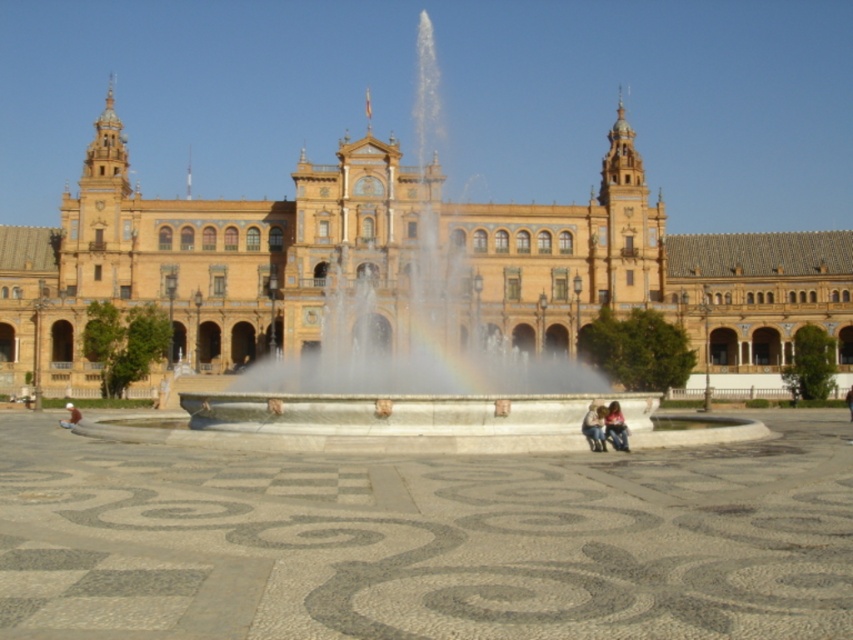
Question: Which object is positioned farthest from the light brown leather jacket at lower right?

Choices:
 (A) denim jeans at center
 (B) golden stone palace at center

Answer: (B)

Question: Which point is closer to the camera taking this photo?

Choices:
 (A) (67, 420)
 (B) (589, 413)
 (C) (622, 442)
 (D) (349, 193)

Answer: (C)

Question: Does denim jeans at center lie behind light brown leather jacket at lower right?

Choices:
 (A) yes
 (B) no

Answer: (A)

Question: Can you confirm if denim jeans at center is positioned below light brown leather jacket at lower left?

Choices:
 (A) no
 (B) yes

Answer: (A)

Question: Does golden stone palace at center appear over light brown leather jacket at lower right?

Choices:
 (A) no
 (B) yes

Answer: (B)

Question: Which point is farther to the camera?

Choices:
 (A) denim jeans at center
 (B) light brown leather jacket at lower left
 (C) golden stone palace at center
 (D) light brown leather jacket at lower right

Answer: (C)